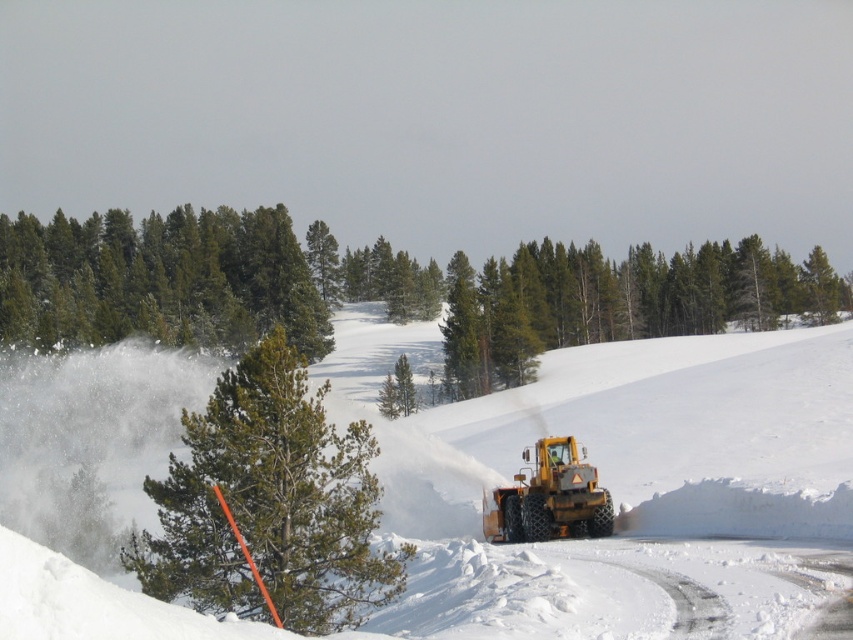
You are a snowplow operator who just finished clearing the road. You want to check the depth of the snow at the white fluffy snow at center. Where should you measure the snow depth?

You should measure the snow depth at the white fluffy snow at center located at point (610, 476).

From the picture: You are a snowplow operator trying to navigate through the snowy road. You see two points marked on your GPS coordinates, point at (283, 321) and point at (500, 259). Which point is closer to your current position?

Point at (283, 321) is closer to the viewer than point at (500, 259), so the operator should head towards point at (283, 321) first as it is nearer.

You are a snowplow operator who needs to clear the road. You see the white fluffy snow at center and the yellow rubber plow at center. Which object is larger in size?

The white fluffy snow at center is bigger than the yellow rubber plow at center.